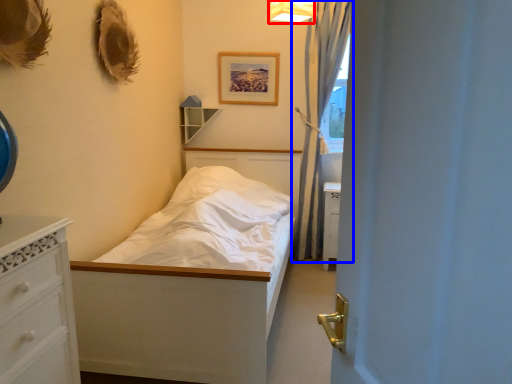
Question: Which object is further to the camera taking this photo, light fixture (highlighted by a red box) or curtain (highlighted by a blue box)?

Choices:
 (A) light fixture
 (B) curtain

Answer: (B)